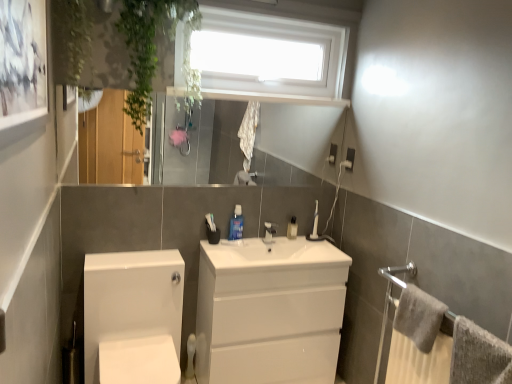
What do you see at coordinates (144, 143) in the screenshot?
I see `glossy glass mirror at upper center` at bounding box center [144, 143].

How much space does white plastic toothbrush at center, which is counted as the 2th toiletry, starting from the left, occupy vertically?

6.20 inches.

Image resolution: width=512 pixels, height=384 pixels. Describe the element at coordinates (292, 228) in the screenshot. I see `white plastic toothbrush at center, placed as the first toiletry when sorted from right to left` at that location.

In order to face gray textured towel at lower right, which is the 2th bath towel in back-to-front order, should I rotate leftwards or rightwards?

You should rotate right by 29.151 degrees.

At what (x,y) coordinates should I click in order to perform the action: click on white matte toilet paper at lower left. Please return your answer as a coordinate pair (x, y). This screenshot has height=384, width=512. Looking at the image, I should click on click(190, 355).

Describe the element at coordinates (269, 58) in the screenshot. The image size is (512, 384). I see `white plastic window at upper center` at that location.

Identify the location of glossy glass mirror at upper center. This screenshot has height=384, width=512. (144, 143).

Is white glossy porcelain at lower left further to the viewer compared to white matte toilet paper at lower left?

No, white glossy porcelain at lower left is closer to the camera.

From a real-world perspective, is white glossy porcelain at lower left physically above white matte toilet paper at lower left?

Yes, from a real-world perspective, white glossy porcelain at lower left is on top of white matte toilet paper at lower left.

Is white glossy porcelain at lower left facing away from white matte toilet paper at lower left?

No, white glossy porcelain at lower left is not facing the opposite direction of white matte toilet paper at lower left.

Between white glossy porcelain at lower left and white plastic window at upper center, which one appears on the left side from the viewer's perspective?

white glossy porcelain at lower left is more to the left.

From the picture: Between white glossy porcelain at lower left and white plastic window at upper center, which one has larger width?

white glossy porcelain at lower left.

Which object is further away from the camera, white glossy porcelain at lower left or white plastic window at upper center?

white plastic window at upper center is more distant.

Is white plastic window at upper center bigger or smaller than white matte toilet paper at lower left?

Clearly, white plastic window at upper center is larger in size than white matte toilet paper at lower left.

Does point (242, 62) lie behind point (192, 344)?

No, (242, 62) is in front of (192, 344).

Locate an element on the screen. toilet paper below the white plastic window at upper center (from a real-world perspective) is located at coordinates (190, 355).

From their relative heights in the image, would you say white plastic window at upper center is taller or shorter than white matte toilet paper at lower left?

Clearly, white plastic window at upper center is taller compared to white matte toilet paper at lower left.

Identify the location of the 2nd toiletry behind the white glossy porcelain at lower left, starting your count from the anchor. (292, 228).

Is white plastic toothbrush at center, placed as the first toiletry when sorted from right to left, looking in the opposite direction of white glossy porcelain at lower left?

No, white plastic toothbrush at center, placed as the first toiletry when sorted from right to left,'s orientation is not away from white glossy porcelain at lower left.

How different are the orientations of white plastic toothbrush at center, which is counted as the 2th toiletry, starting from the left, and white glossy porcelain at lower left in degrees?

The angular difference between white plastic toothbrush at center, which is counted as the 2th toiletry, starting from the left, and white glossy porcelain at lower left is 0.805 degrees.

Who is smaller, white plastic toothbrush at center, placed as the first toiletry when sorted from right to left, or white glossy porcelain at lower left?

white plastic toothbrush at center, placed as the first toiletry when sorted from right to left, is smaller.

Considering the points (257, 248) and (266, 240), which point is behind, point (257, 248) or point (266, 240)?

Positioned behind is point (266, 240).

Based on the photo, is white glossy cabinet at center next to white ceramic tap at center and touching it?

No, white glossy cabinet at center is not touching white ceramic tap at center.

Looking at the image, does white glossy cabinet at center seem bigger or smaller compared to white ceramic tap at center?

Considering their sizes, white glossy cabinet at center takes up more space than white ceramic tap at center.

Is white glossy cabinet at center not inside white ceramic tap at center?

white glossy cabinet at center lies outside white ceramic tap at center's area.

Looking at this image, which is closer, (132, 170) or (329, 246)?

Point (132, 170).

The height and width of the screenshot is (384, 512). Find the location of `mirror on the left side of white glossy cabinet at center`. mirror on the left side of white glossy cabinet at center is located at coordinates (144, 143).

Considering the sizes of glossy glass mirror at upper center and white glossy cabinet at center in the image, is glossy glass mirror at upper center wider or thinner than white glossy cabinet at center?

glossy glass mirror at upper center is thinner than white glossy cabinet at center.

From a real-world perspective, is glossy glass mirror at upper center below white glossy cabinet at center?

No, from a real-world perspective, glossy glass mirror at upper center is not beneath white glossy cabinet at center.

Where is `porcelain below the white ceramic tap at center (from a real-world perspective)`? Image resolution: width=512 pixels, height=384 pixels. porcelain below the white ceramic tap at center (from a real-world perspective) is located at coordinates pyautogui.click(x=133, y=317).

How many degrees apart are the facing directions of white glossy porcelain at lower left and white ceramic tap at center?

Result: The angle between the facing direction of white glossy porcelain at lower left and the facing direction of white ceramic tap at center is 0.805 degrees.

Does white glossy porcelain at lower left have a smaller size compared to white ceramic tap at center?

No, white glossy porcelain at lower left is not smaller than white ceramic tap at center.

In order to click on toilet paper behind the white glossy porcelain at lower left in this screenshot , I will do pyautogui.click(x=190, y=355).

Identify the location of porcelain below the white plastic window at upper center (from the image's perspective). Image resolution: width=512 pixels, height=384 pixels. (133, 317).

From the image, which object appears to be nearer to gray textured towel at lower right, which is the 2th bath towel in back-to-front order, glossy glass mirror at upper center or white glossy cabinet at center?

white glossy cabinet at center is closer to gray textured towel at lower right, which is the 2th bath towel in back-to-front order.

Estimate the real-world distances between objects in this image. Which object is further from white plastic toothbrush at center, which is counted as the 2th toiletry, starting from the left, white ceramic tap at center or blue glossy mouthwash at center, which appears as the second toiletry when viewed from the back?

Among the two, blue glossy mouthwash at center, which appears as the second toiletry when viewed from the back, is located further to white plastic toothbrush at center, which is counted as the 2th toiletry, starting from the left.

Looking at this image, considering their positions, is gray textured towel at lower right, which ranks as the 2th bath towel in front-to-back order, positioned further to white plastic window at upper center than white glossy porcelain at lower left?

gray textured towel at lower right, which ranks as the 2th bath towel in front-to-back order, is positioned further to the anchor white plastic window at upper center.

Based on the photo, when comparing their distances from gray textured towel at lower right, which ranks as the 2th bath towel in front-to-back order, does blue glossy mouthwash at center, the second toiletry viewed from the right, or glossy glass mirror at upper center seem further?

Based on the image, glossy glass mirror at upper center appears to be further to gray textured towel at lower right, which ranks as the 2th bath towel in front-to-back order.

Which object lies further to the anchor point white plastic toothbrush at center, which is counted as the 2th toiletry, starting from the left, gray textured towel at lower right, which ranks as the 2th bath towel in front-to-back order, or white matte toilet paper at lower left?

gray textured towel at lower right, which ranks as the 2th bath towel in front-to-back order.

Estimate the real-world distances between objects in this image. Which object is closer to glossy glass mirror at upper center, gray textured towel at lower right, acting as the first bath towel starting from the back, or white plastic toothbrush at center, which is counted as the 2th toiletry, starting from the left?

white plastic toothbrush at center, which is counted as the 2th toiletry, starting from the left, lies closer to glossy glass mirror at upper center than the other object.

Looking at the image, which one is located closer to glossy glass mirror at upper center, white plastic window at upper center or white glossy cabinet at center?

Based on the image, white plastic window at upper center appears to be nearer to glossy glass mirror at upper center.

Which object lies further to the anchor point gray textured towel at lower right, which is the 2th bath towel in back-to-front order, white plastic toothbrush at center, which ranks as the 1th toiletry in back-to-front order, or white matte toilet paper at lower left?

Based on the image, white matte toilet paper at lower left appears to be further to gray textured towel at lower right, which is the 2th bath towel in back-to-front order.

Image resolution: width=512 pixels, height=384 pixels. Identify the location of bathroom cabinet between white matte toilet paper at lower left and gray textured towel at lower right, acting as the first bath towel starting from the back, in the horizontal direction. (269, 311).

Where is `bath towel between gray textured towel at lower right, which is the 2th bath towel in back-to-front order, and white ceramic tap at center in the front-back direction`? Image resolution: width=512 pixels, height=384 pixels. bath towel between gray textured towel at lower right, which is the 2th bath towel in back-to-front order, and white ceramic tap at center in the front-back direction is located at coordinates (419, 317).

At what (x,y) coordinates should I click in order to perform the action: click on bathroom cabinet between white glossy porcelain at lower left and blue glossy mouthwash at center, the second toiletry viewed from the right, from front to back. Please return your answer as a coordinate pair (x, y). Image resolution: width=512 pixels, height=384 pixels. Looking at the image, I should click on (269, 311).

The height and width of the screenshot is (384, 512). What are the coordinates of `bathroom cabinet positioned between white glossy porcelain at lower left and white plastic toothbrush at center, placed as the first toiletry when sorted from right to left, from near to far` in the screenshot? It's located at (269, 311).